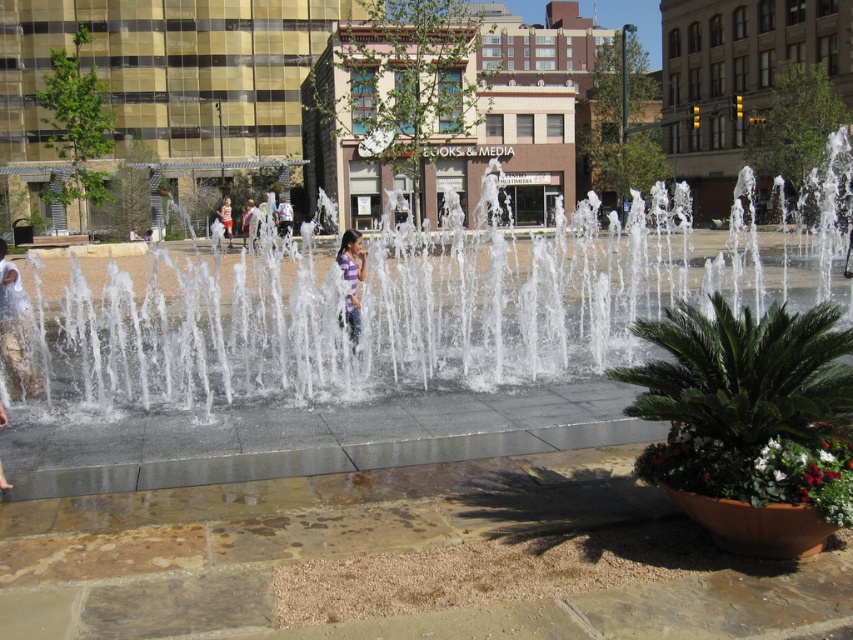
Question: Does clear water at center appear on the left side of matte purple shirt at left?

Choices:
 (A) no
 (B) yes

Answer: (A)

Question: Among these points, which one is farthest from the camera?

Choices:
 (A) (815, 248)
 (B) (9, 284)
 (C) (352, 308)

Answer: (A)

Question: Which point is closer to the camera?

Choices:
 (A) (219, 308)
 (B) (229, 216)
 (C) (360, 236)

Answer: (C)

Question: Which object is closer to the camera taking this photo?

Choices:
 (A) matte purple shirt at center
 (B) purple striped shirt at center
 (C) matte purple shirt at left

Answer: (C)

Question: Does clear water at center appear on the left side of matte purple shirt at center?

Choices:
 (A) yes
 (B) no

Answer: (B)

Question: Is purple striped shirt at center smaller than matte purple shirt at center?

Choices:
 (A) yes
 (B) no

Answer: (B)